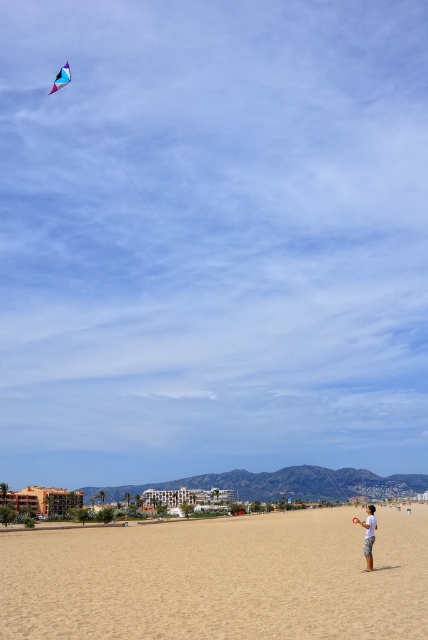
Question: Which of the following is the farthest from the observer?

Choices:
 (A) translucent blue kite at upper left
 (B) sandy beach at lower center
 (C) light blue cotton shorts at lower right

Answer: (A)

Question: Is sandy beach at lower center smaller than light blue cotton shorts at lower right?

Choices:
 (A) yes
 (B) no

Answer: (B)

Question: Which object is positioned closest to the sandy beach at lower center?

Choices:
 (A) translucent blue kite at upper left
 (B) light blue cotton shorts at lower right

Answer: (B)

Question: Does sandy beach at lower center appear on the right side of light blue cotton shorts at lower right?

Choices:
 (A) no
 (B) yes

Answer: (A)

Question: Is light blue cotton shorts at lower right below translucent blue kite at upper left?

Choices:
 (A) yes
 (B) no

Answer: (A)

Question: Which object is closer to the camera taking this photo?

Choices:
 (A) sandy beach at lower center
 (B) light blue cotton shorts at lower right

Answer: (A)